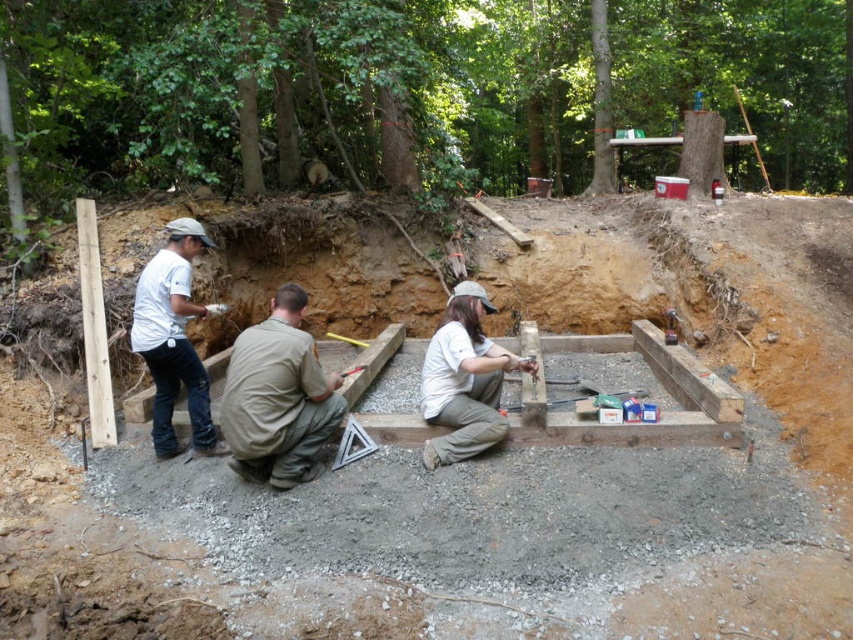
Question: Which of the following is the closest to the observer?

Choices:
 (A) brown uniform at center
 (B) white cotton shirt at center
 (C) white matte shirt at left

Answer: (A)

Question: Which object appears closest to the camera in this image?

Choices:
 (A) white cotton shirt at center
 (B) white matte shirt at left

Answer: (A)

Question: From the image, what is the correct spatial relationship of white matte shirt at left in relation to white cotton shirt at center?

Choices:
 (A) below
 (B) above

Answer: (B)

Question: Which point appears farthest from the camera in this image?

Choices:
 (A) (244, 387)
 (B) (160, 456)

Answer: (B)

Question: Is white matte shirt at left in front of white cotton shirt at center?

Choices:
 (A) no
 (B) yes

Answer: (A)

Question: Can you confirm if white matte shirt at left is wider than white cotton shirt at center?

Choices:
 (A) no
 (B) yes

Answer: (A)